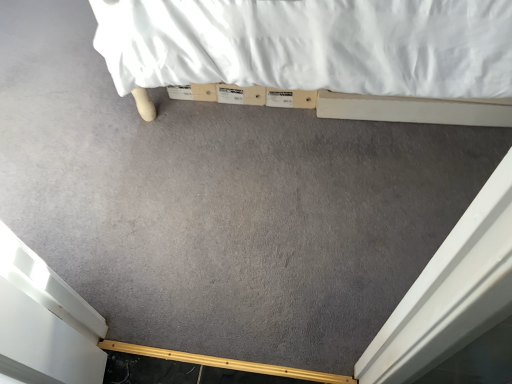
At what (x,y) coordinates should I click in order to perform the action: click on white matte bed at upper center. Please return your answer as a coordinate pair (x, y). This screenshot has height=384, width=512. Looking at the image, I should click on (417, 110).

What do you see at coordinates (417, 110) in the screenshot? I see `white matte bed at upper center` at bounding box center [417, 110].

This screenshot has width=512, height=384. Identify the location of white matte bed at upper center. (417, 110).